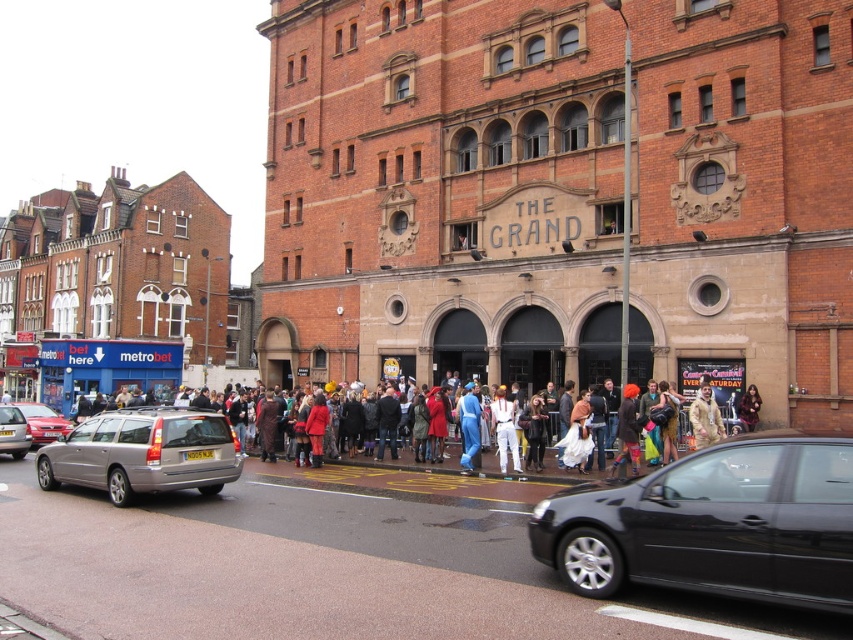
Does multicolored costumes at center come behind velvet red dress at center?

No, it is in front of velvet red dress at center.

Between point (556, 445) and point (741, 400), which one is positioned in front?

Point (741, 400) is more forward.

What do you see at coordinates (660, 422) in the screenshot?
I see `multicolored costumes at center` at bounding box center [660, 422].

You are a GUI agent. You are given a task and a screenshot of the screen. Output one action in this format:
    pyautogui.click(x=<x>, y=<y>)
    Task: Click on the multicolored costumes at center
    The width and height of the screenshot is (853, 640).
    Given the screenshot: What is the action you would take?
    pyautogui.click(x=660, y=422)

Between silver metallic hatchback at left and silver metallic hatchback at center-left, which one has less height?

silver metallic hatchback at center-left is shorter.

Does silver metallic hatchback at left have a greater width compared to silver metallic hatchback at center-left?

Yes.

Identify the location of silver metallic hatchback at left. (44, 422).

How much distance is there between silver metallic estate car at left and velvet red dress at center?

silver metallic estate car at left is 27.48 meters from velvet red dress at center.

Between point (128, 497) and point (753, 419), which one is positioned behind?

Positioned behind is point (753, 419).

Which is behind, point (39, 449) or point (758, 419)?

Positioned behind is point (39, 449).

The height and width of the screenshot is (640, 853). I want to click on silver metallic estate car at left, so click(x=143, y=452).